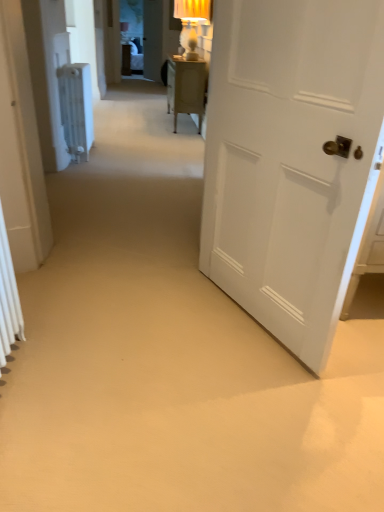
Identify the location of free location to the right of white plastic radiator at left. This screenshot has width=384, height=512. (128, 153).